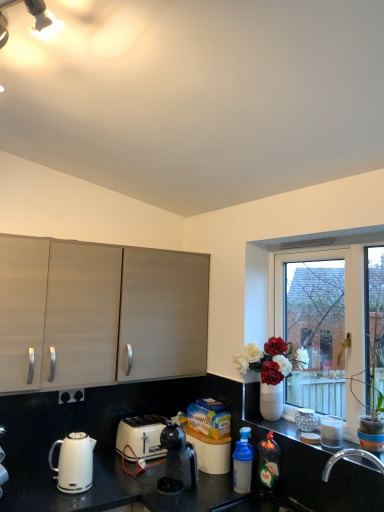
Locate an element on the screen. The height and width of the screenshot is (512, 384). black plastic coffee maker at center is located at coordinates (177, 461).

Measure the distance between point (284, 318) and camera.

Point (284, 318) is 2.53 meters from camera.

In order to click on translucent glass vase at lower right in this screenshot , I will do `click(272, 424)`.

Is matte wood cabinets at left bigger or smaller than metallic silver canisters at right, marked as the 1th appliance in a back-to-front arrangement?

matte wood cabinets at left is bigger than metallic silver canisters at right, marked as the 1th appliance in a back-to-front arrangement.

Is matte wood cabinets at left oriented away from metallic silver canisters at right, marked as the 2th appliance in a front-to-back arrangement?

matte wood cabinets at left is not turned away from metallic silver canisters at right, marked as the 2th appliance in a front-to-back arrangement.

From a real-world perspective, is matte wood cabinets at left located higher than metallic silver canisters at right, marked as the 1th appliance in a back-to-front arrangement?

Yes, from a real-world perspective, matte wood cabinets at left is on top of metallic silver canisters at right, marked as the 1th appliance in a back-to-front arrangement.

Considering the positions of objects metallic silver canisters at right, marked as the 2th appliance in a front-to-back arrangement, and white glossy kettle at lower left in the image provided, who is more to the right, metallic silver canisters at right, marked as the 2th appliance in a front-to-back arrangement, or white glossy kettle at lower left?

metallic silver canisters at right, marked as the 2th appliance in a front-to-back arrangement.

Is metallic silver canisters at right, marked as the 2th appliance in a front-to-back arrangement, behind white glossy kettle at lower left?

Yes, it is behind white glossy kettle at lower left.

From a real-world perspective, is metallic silver canisters at right, marked as the 1th appliance in a back-to-front arrangement, below white glossy kettle at lower left?

No, from a real-world perspective, metallic silver canisters at right, marked as the 1th appliance in a back-to-front arrangement, is not beneath white glossy kettle at lower left.

Considering the sizes of objects metallic silver canisters at right, marked as the 1th appliance in a back-to-front arrangement, and white glossy kettle at lower left in the image provided, who is shorter, metallic silver canisters at right, marked as the 1th appliance in a back-to-front arrangement, or white glossy kettle at lower left?

With less height is metallic silver canisters at right, marked as the 1th appliance in a back-to-front arrangement.

What's the angular difference between white glossy sink at lower right and black plastic coffee maker at center's facing directions?

2.23 degrees.

Is white glossy sink at lower right to the left of black plastic coffee maker at center from the viewer's perspective?

No, white glossy sink at lower right is not to the left of black plastic coffee maker at center.

Could you tell me if white glossy sink at lower right is facing black plastic coffee maker at center?

No, white glossy sink at lower right is not aimed at black plastic coffee maker at center.

Where is `sink in front of the black plastic coffee maker at center`? Image resolution: width=384 pixels, height=512 pixels. sink in front of the black plastic coffee maker at center is located at coordinates (259, 504).

Is translucent plastic bottle at lower right, the 1th bottle from the left, thinner than black plastic coffee maker at center?

Yes.

Is translucent plastic bottle at lower right, which is counted as the second bottle, starting from the right, beside black plastic coffee maker at center?

translucent plastic bottle at lower right, which is counted as the second bottle, starting from the right, and black plastic coffee maker at center are not in contact.

Considering the positions of objects translucent plastic bottle at lower right, the 1th bottle from the left, and black plastic coffee maker at center in the image provided, who is in front, translucent plastic bottle at lower right, the 1th bottle from the left, or black plastic coffee maker at center?

black plastic coffee maker at center is closer to the camera.

Would you say translucent plastic bottle at lower right, which is counted as the second bottle, starting from the right, is outside black plastic coffee maker at center?

translucent plastic bottle at lower right, which is counted as the second bottle, starting from the right, lies outside black plastic coffee maker at center's area.

From a real-world perspective, who is located higher, white glossy jar at lower right, positioned as the first appliance in front-to-back order, or metallic silver canisters at right, marked as the 2th appliance in a front-to-back arrangement?

white glossy jar at lower right, positioned as the first appliance in front-to-back order, from a real-world perspective.

Which is in front, white glossy jar at lower right, which is the second appliance in back-to-front order, or metallic silver canisters at right, marked as the 2th appliance in a front-to-back arrangement?

Positioned in front is white glossy jar at lower right, which is the second appliance in back-to-front order.

Can you confirm if white glossy jar at lower right, positioned as the first appliance in front-to-back order, is positioned to the right of metallic silver canisters at right, marked as the 2th appliance in a front-to-back arrangement?

Yes.

Is white glossy jar at lower right, which is the second appliance in back-to-front order, aimed at metallic silver canisters at right, marked as the 1th appliance in a back-to-front arrangement?

No.

Where is `kettle on the left side of matte wood cabinets at left`? This screenshot has height=512, width=384. kettle on the left side of matte wood cabinets at left is located at coordinates (74, 463).

Looking at this image, can you confirm if matte wood cabinets at left is smaller than white glossy kettle at lower left?

No.

Considering the sizes of objects matte wood cabinets at left and white glossy kettle at lower left in the image provided, who is thinner, matte wood cabinets at left or white glossy kettle at lower left?

white glossy kettle at lower left is thinner.

Is the surface of matte wood cabinets at left in direct contact with white glossy kettle at lower left?

No, matte wood cabinets at left is not with white glossy kettle at lower left.

From a real-world perspective, is black plastic electrical outlet at lower left positioned above or below white glossy sink at lower right?

black plastic electrical outlet at lower left is above white glossy sink at lower right.

Where is `sink lying in front of the black plastic electrical outlet at lower left`? sink lying in front of the black plastic electrical outlet at lower left is located at coordinates (259, 504).

Looking at this image, is black plastic electrical outlet at lower left smaller than white glossy sink at lower right?

Yes.

Can you tell me how much black plastic electrical outlet at lower left and white glossy sink at lower right differ in facing direction?

The facing directions of black plastic electrical outlet at lower left and white glossy sink at lower right are 87.2 degrees apart.

The height and width of the screenshot is (512, 384). I want to click on cabinetry in front of the metallic silver canisters at right, marked as the 1th appliance in a back-to-front arrangement, so click(99, 314).

At what (x,y) coordinates should I click in order to perform the action: click on appliance that appears behind the white glossy kettle at lower left. Please return your answer as a coordinate pair (x, y). This screenshot has width=384, height=512. Looking at the image, I should click on (306, 420).

Estimate the real-world distances between objects in this image. Which object is further from white plastic toaster at lower center, white glossy sink at lower right or translucent plastic bottle at lower right, the 1th bottle from the left?

white glossy sink at lower right is positioned further to the anchor white plastic toaster at lower center.

Based on their spatial positions, is white glossy sink at lower right or black plastic coffee maker at center further from white plastic toaster at lower center?

Among the two, white glossy sink at lower right is located further to white plastic toaster at lower center.

Which object lies nearer to the anchor point matte wood cabinets at left, white glass window at right or white glossy jar at lower right, which is the second appliance in back-to-front order?

Based on the image, white glass window at right appears to be nearer to matte wood cabinets at left.

When comparing their distances from translucent plastic bottle at lower right, placed as the 1th bottle when sorted from right to left, does translucent glass vase at lower right or white glass window at right seem further?

Among the two, white glass window at right is located further to translucent plastic bottle at lower right, placed as the 1th bottle when sorted from right to left.

Looking at the image, which one is located closer to translucent glass vase at lower right, white glossy jar at lower right, positioned as the first appliance in front-to-back order, or white glass window at right?

Based on the image, white glossy jar at lower right, positioned as the first appliance in front-to-back order, appears to be nearer to translucent glass vase at lower right.

Considering their positions, is translucent plastic bottle at lower right, which is counted as the second bottle, starting from the right, positioned further to black plastic electrical outlet at lower left than white glossy kettle at lower left?

The object further to black plastic electrical outlet at lower left is translucent plastic bottle at lower right, which is counted as the second bottle, starting from the right.

Looking at the image, which one is located closer to translucent glass vase at lower right, white glossy sink at lower right or white plastic toaster at lower center?

white glossy sink at lower right is positioned closer to the anchor translucent glass vase at lower right.

Looking at the image, which one is located further to black plastic coffee maker at center, white plastic toaster at lower center or black plastic electrical outlet at lower left?

Among the two, black plastic electrical outlet at lower left is located further to black plastic coffee maker at center.

This screenshot has height=512, width=384. I want to click on cabinetry located between white glossy kettle at lower left and white glossy sink at lower right in the left-right direction, so click(99, 314).

What are the coordinates of `window sill situated between white glossy sink at lower right and white glossy jar at lower right, which is the second appliance in back-to-front order, from left to right` in the screenshot? It's located at (272, 424).

Locate an element on the screen. appliance situated between matte wood cabinets at left and white glossy jar at lower right, positioned as the first appliance in front-to-back order, from left to right is located at coordinates (306, 420).

This screenshot has height=512, width=384. Find the location of `window sill located between white glossy kettle at lower left and white glossy jar at lower right, which is the second appliance in back-to-front order, in the left-right direction`. window sill located between white glossy kettle at lower left and white glossy jar at lower right, which is the second appliance in back-to-front order, in the left-right direction is located at coordinates (272, 424).